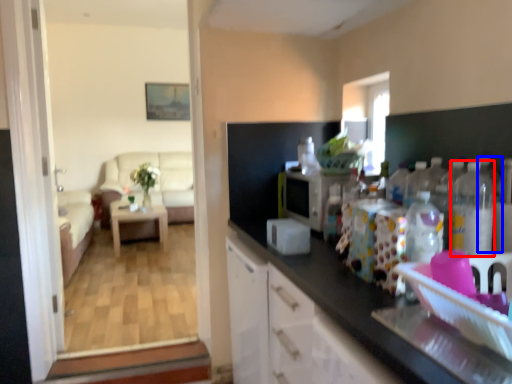
Question: Which point is further to the camera, bottle (highlighted by a red box) or bottle (highlighted by a blue box)?

Choices:
 (A) bottle
 (B) bottle

Answer: (B)